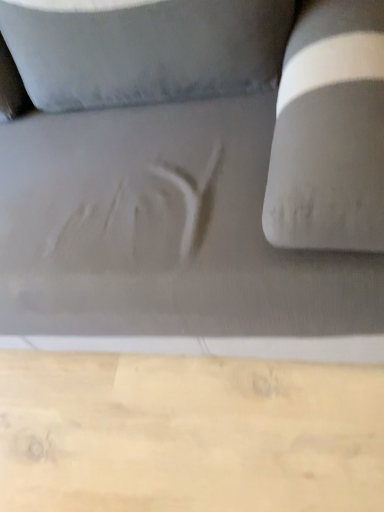
The height and width of the screenshot is (512, 384). What do you see at coordinates (188, 434) in the screenshot?
I see `wooden plank at lower center` at bounding box center [188, 434].

The image size is (384, 512). In order to click on wooden plank at lower center in this screenshot , I will do `click(188, 434)`.

The height and width of the screenshot is (512, 384). In order to click on matte gray fabric couch at center in this screenshot , I will do 195,170.

Describe the element at coordinates (195, 170) in the screenshot. The height and width of the screenshot is (512, 384). I see `matte gray fabric couch at center` at that location.

Find the location of a particular element. wooden plank at lower center is located at coordinates coord(188,434).

Based on their positions, is matte gray fabric couch at center located to the left or right of wooden plank at lower center?

matte gray fabric couch at center is positioned on wooden plank at lower center's left side.

In the image, is matte gray fabric couch at center positioned in front of or behind wooden plank at lower center?

In the image, matte gray fabric couch at center appears in front of wooden plank at lower center.

Between point (250, 150) and point (47, 361), which one is positioned behind?

Point (47, 361)

From the image's perspective, between matte gray fabric couch at center and wooden plank at lower center, which one is located above?

matte gray fabric couch at center appears higher in the image.

From a real-world perspective, between matte gray fabric couch at center and wooden plank at lower center, who is vertically higher?

matte gray fabric couch at center is physically above.

Between matte gray fabric couch at center and wooden plank at lower center, which one has larger width?

wooden plank at lower center.

From the picture: Considering the sizes of matte gray fabric couch at center and wooden plank at lower center in the image, is matte gray fabric couch at center taller or shorter than wooden plank at lower center?

In the image, matte gray fabric couch at center appears to be taller than wooden plank at lower center.

In the scene shown: Can you confirm if matte gray fabric couch at center is bigger than wooden plank at lower center?

Yes.

Is matte gray fabric couch at center located outside wooden plank at lower center?

matte gray fabric couch at center is positioned outside wooden plank at lower center.

Is matte gray fabric couch at center not near wooden plank at lower center?

No.

Based on the photo, is wooden plank at lower center at the back of matte gray fabric couch at center?

matte gray fabric couch at center does not have its back to wooden plank at lower center.

How different are the orientations of matte gray fabric couch at center and wooden plank at lower center in degrees?

There is a 90-degree angle between the facing directions of matte gray fabric couch at center and wooden plank at lower center.

At what (x,y) coordinates should I click in order to perform the action: click on cardboard that is below the matte gray fabric couch at center (from the image's perspective). Please return your answer as a coordinate pair (x, y). Looking at the image, I should click on (x=188, y=434).

Considering the relative positions of wooden plank at lower center and matte gray fabric couch at center in the image provided, is wooden plank at lower center to the left of matte gray fabric couch at center from the viewer's perspective?

No, wooden plank at lower center is not to the left of matte gray fabric couch at center.

Between wooden plank at lower center and matte gray fabric couch at center, which one is positioned behind?

wooden plank at lower center is behind.

Does point (235, 490) come closer to viewer compared to point (194, 225)?

No, (235, 490) is further to viewer.

From the image's perspective, is wooden plank at lower center located above or below matte gray fabric couch at center?

wooden plank at lower center is below matte gray fabric couch at center.

From a real-world perspective, which is physically above, wooden plank at lower center or matte gray fabric couch at center?

In real-world perspective, matte gray fabric couch at center is above.

Considering the sizes of objects wooden plank at lower center and matte gray fabric couch at center in the image provided, who is thinner, wooden plank at lower center or matte gray fabric couch at center?

matte gray fabric couch at center.

Who is taller, wooden plank at lower center or matte gray fabric couch at center?

With more height is matte gray fabric couch at center.

Based on the photo, does wooden plank at lower center have a larger size compared to matte gray fabric couch at center?

Incorrect, wooden plank at lower center is not larger than matte gray fabric couch at center.

Is matte gray fabric couch at center a part of wooden plank at lower center?

No, matte gray fabric couch at center is not inside wooden plank at lower center.

Is wooden plank at lower center far away from matte gray fabric couch at center?

No, wooden plank at lower center is not far from matte gray fabric couch at center.

Could you tell me if wooden plank at lower center is turned towards matte gray fabric couch at center?

No, wooden plank at lower center is not facing towards matte gray fabric couch at center.

How many degrees apart are the facing directions of wooden plank at lower center and matte gray fabric couch at center?

They differ by 90 degrees in their facing directions.

Where is `cardboard located underneath the matte gray fabric couch at center (from a real-world perspective)`? cardboard located underneath the matte gray fabric couch at center (from a real-world perspective) is located at coordinates (188, 434).

Where is `studio couch on the left of wooden plank at lower center`? This screenshot has width=384, height=512. studio couch on the left of wooden plank at lower center is located at coordinates (195, 170).

You are a GUI agent. You are given a task and a screenshot of the screen. Output one action in this format:
    pyautogui.click(x=<x>, y=<y>)
    Task: Click on the cardboard that appears below the matte gray fabric couch at center (from the image's perspective)
    
    Given the screenshot: What is the action you would take?
    coord(188,434)